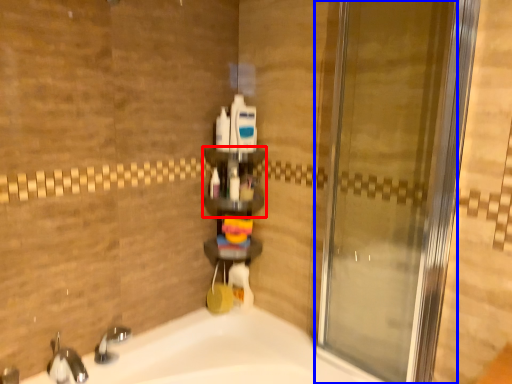
Question: Which object is closer to the camera taking this photo, shelf (highlighted by a red box) or door (highlighted by a blue box)?

Choices:
 (A) shelf
 (B) door

Answer: (B)